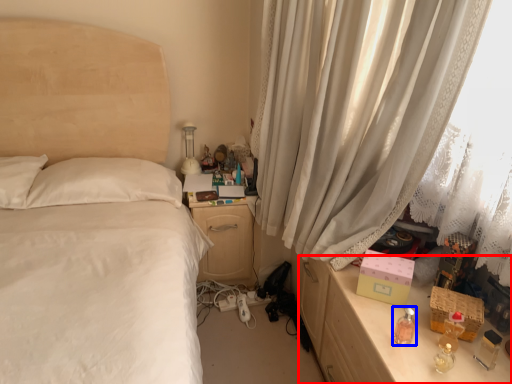
Question: Which object is closer to the camera taking this photo, vanity (highlighted by a red box) or perfume (highlighted by a blue box)?

Choices:
 (A) vanity
 (B) perfume

Answer: (A)